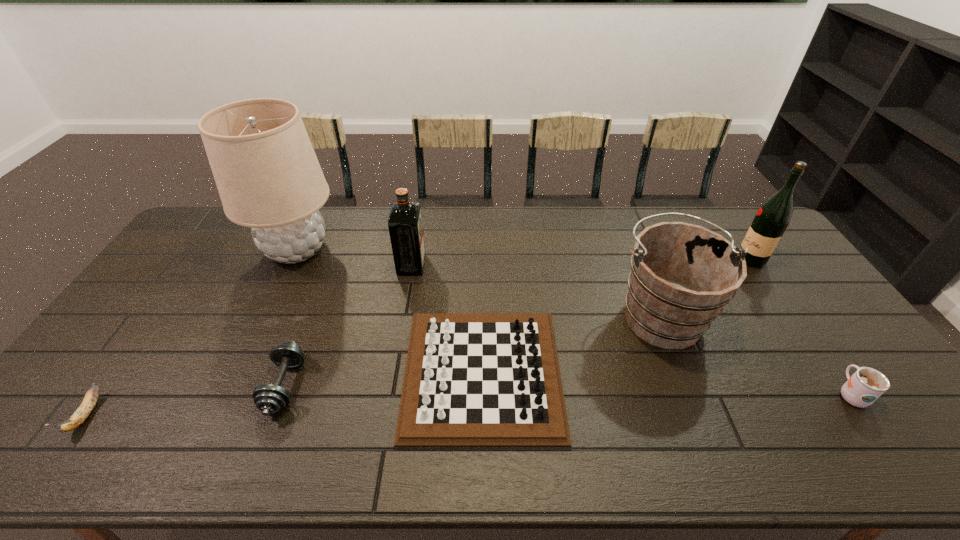
Find the location of a particular element. lampshade is located at coordinates (268, 177).

Where is `the taller liquor`? the taller liquor is located at coordinates (773, 217).

Find the location of a particular element. This screenshot has height=540, width=960. the right liquor is located at coordinates 773,217.

The width and height of the screenshot is (960, 540). I want to click on the shorter liquor, so click(405, 225).

Image resolution: width=960 pixels, height=540 pixels. I want to click on the third object from right to left, so click(682, 275).

Where is `cup`? This screenshot has width=960, height=540. cup is located at coordinates (866, 385).

You are a GUI agent. You are given a task and a screenshot of the screen. Output one action in this format:
    pyautogui.click(x=<x>, y=<y>)
    Task: Click on the dumbbell
    
    Given the screenshot: What is the action you would take?
    pyautogui.click(x=269, y=398)

Where is `gameboard`? gameboard is located at coordinates (471, 379).

This screenshot has width=960, height=540. Find the location of `banana`. banana is located at coordinates (81, 414).

Where is `vacant space located on the back of the tallest object`? vacant space located on the back of the tallest object is located at coordinates (315, 212).